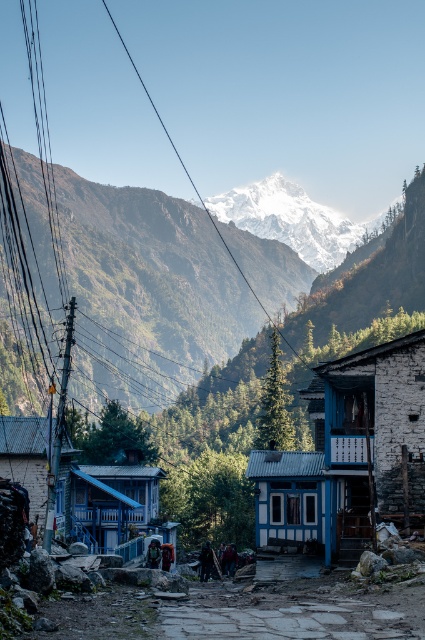
Question: Which object is farther from the camera taking this photo?

Choices:
 (A) dusty stone path at center
 (B) blue corrugated metal hut at center
 (C) white stone building at center

Answer: (B)

Question: Considering the relative positions of white stone building at center and white painted wood hut at lower left in the image provided, where is white stone building at center located with respect to white painted wood hut at lower left?

Choices:
 (A) left
 (B) right

Answer: (B)

Question: Which point is closer to the camera?

Choices:
 (A) white painted wood hut at lower left
 (B) blue painted wood hut at center
 (C) white stone building at center
 (D) blue corrugated metal hut at center

Answer: (C)

Question: Can you confirm if white stone building at center is positioned to the left of blue corrugated metal hut at center?

Choices:
 (A) yes
 (B) no

Answer: (B)

Question: Which object is positioned closest to the white painted wood hut at lower left?

Choices:
 (A) blue corrugated metal hut at center
 (B) white snow-covered mountain at upper center

Answer: (A)

Question: Does white stone building at center have a smaller size compared to blue corrugated metal hut at center?

Choices:
 (A) no
 (B) yes

Answer: (B)